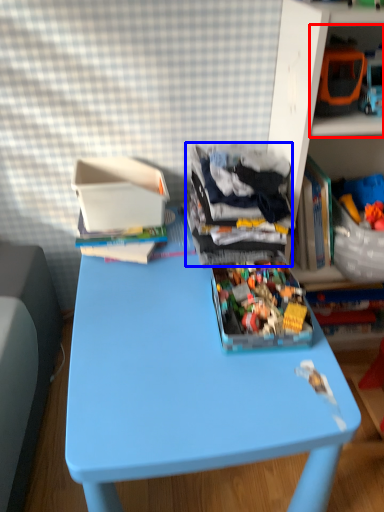
Question: Which object is closer to the camera taking this photo, shelf (highlighted by a red box) or clothing (highlighted by a blue box)?

Choices:
 (A) shelf
 (B) clothing

Answer: (A)